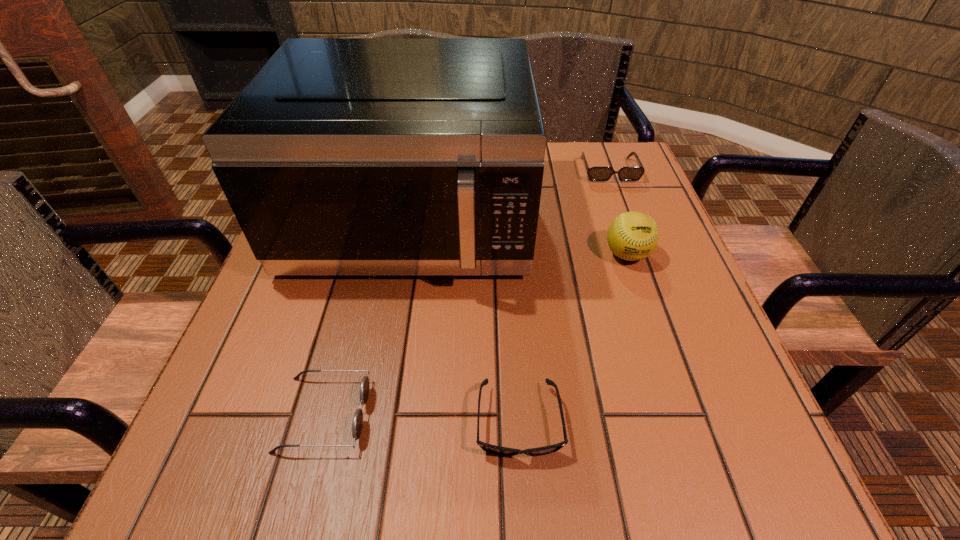
The height and width of the screenshot is (540, 960). Identify the location of empty space between the second sunglasses from left to right and the leftmost sunglasses. (421, 418).

This screenshot has width=960, height=540. Find the location of `object that is the third nearest to the tallest object`. object that is the third nearest to the tallest object is located at coordinates (357, 425).

Find the location of a particular element. Image resolution: width=960 pixels, height=540 pixels. object that ranks as the closest to the farthest sunglasses is located at coordinates (342, 156).

At what (x,y) coordinates should I click in order to perform the action: click on sunglasses identified as the closest to the softball. Please return your answer as a coordinate pair (x, y). This screenshot has width=960, height=540. Looking at the image, I should click on (594, 173).

Identify the location of sunglasses object that ranks as the second closest to the rightmost sunglasses. The image size is (960, 540). (357, 425).